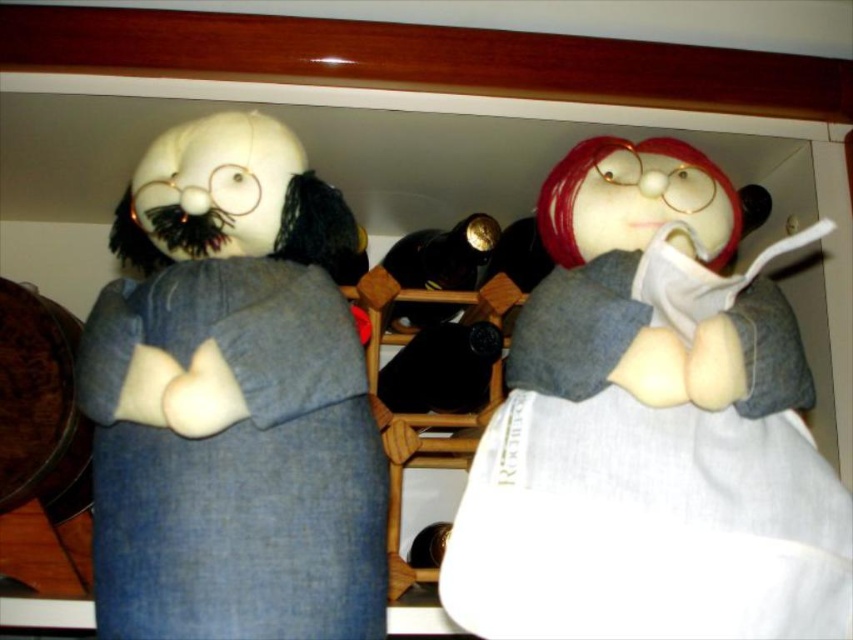
Is white fabric doll at upper right wider than denim jacket at left?

Yes.

Is point (721, 220) farther from camera compared to point (329, 522)?

Yes, point (721, 220) is farther from viewer.

Where is `white fabric doll at upper right`? white fabric doll at upper right is located at coordinates (650, 428).